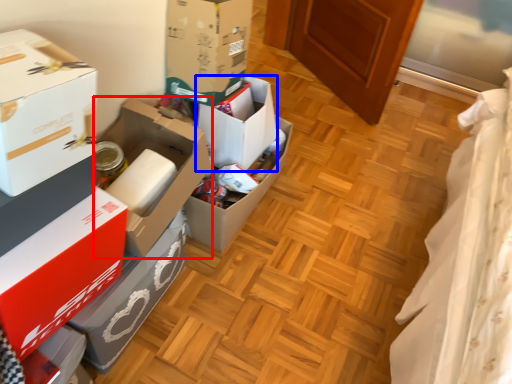
Question: Which point is closer to the camera, box (highlighted by a red box) or box (highlighted by a blue box)?

Choices:
 (A) box
 (B) box

Answer: (A)